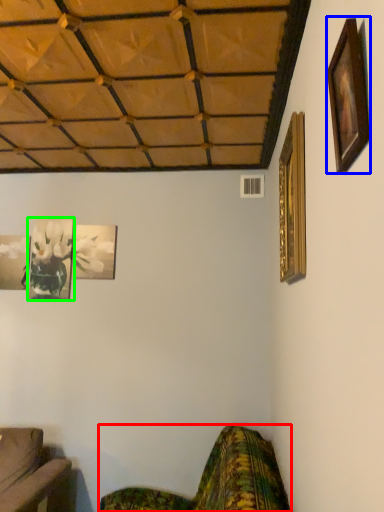
Question: Estimate the real-world distances between objects in this image. Which object is farther from studio couch (highlighted by a red box), picture frame (highlighted by a blue box) or picture frame (highlighted by a green box)?

Choices:
 (A) picture frame
 (B) picture frame

Answer: (B)